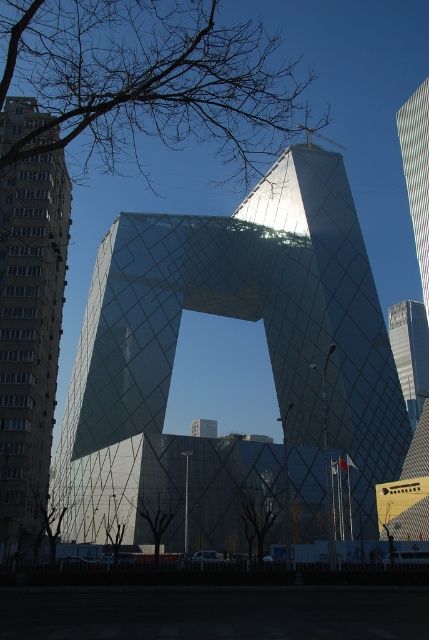
Question: Is matte glass skyscraper at left further to camera compared to metallic glass skyscraper at upper right?

Choices:
 (A) yes
 (B) no

Answer: (B)

Question: Estimate the real-world distances between objects in this image. Which object is farther from the matte glass skyscraper at left?

Choices:
 (A) reflective glass tower at center
 (B) metallic glass skyscraper at upper right

Answer: (B)

Question: Does reflective glass tower at center appear on the left side of matte glass skyscraper at left?

Choices:
 (A) yes
 (B) no

Answer: (B)

Question: Can you confirm if matte glass skyscraper at left is wider than metallic glass skyscraper at upper right?

Choices:
 (A) yes
 (B) no

Answer: (B)

Question: Estimate the real-world distances between objects in this image. Which object is farther from the matte glass skyscraper at left?

Choices:
 (A) reflective glass tower at center
 (B) metallic glass skyscraper at upper right

Answer: (B)

Question: Which of the following is the farthest from the observer?

Choices:
 (A) metallic glass skyscraper at upper right
 (B) reflective glass tower at center
 (C) matte glass skyscraper at left

Answer: (A)